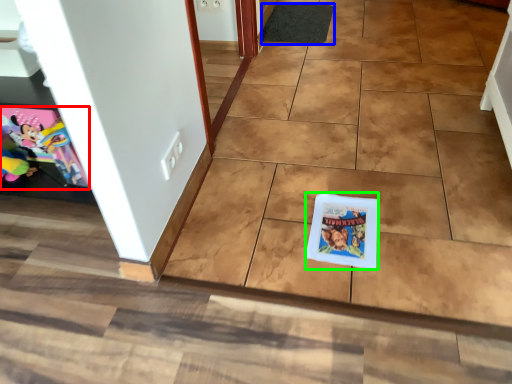
Question: Based on their relative distances, which object is farther from comic book (highlighted by a red box)? Choose from doormat (highlighted by a blue box) and comic book (highlighted by a green box).

Choices:
 (A) doormat
 (B) comic book

Answer: (A)